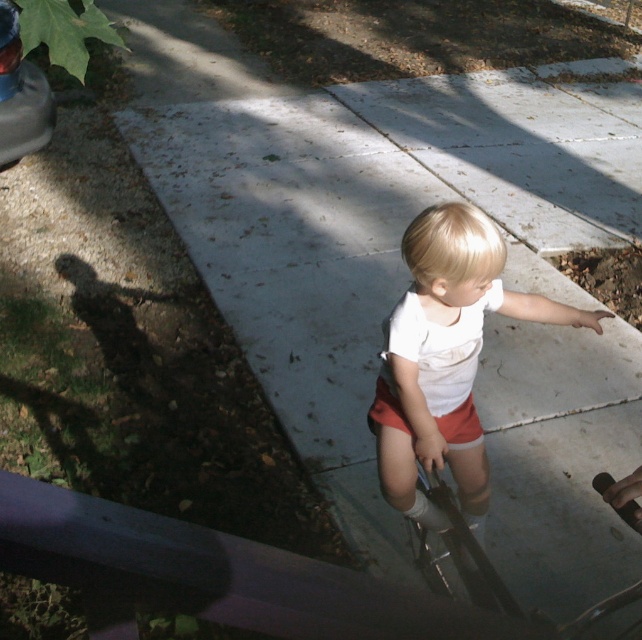
Question: Observing the image, what is the correct spatial positioning of shiny concrete puddle at lower right in reference to orange cotton shorts at center?

Choices:
 (A) left
 (B) right

Answer: (B)

Question: Does white matte shorts at center have a smaller size compared to orange cotton shorts at center?

Choices:
 (A) yes
 (B) no

Answer: (B)

Question: Does white matte shorts at center come behind shiny concrete puddle at lower right?

Choices:
 (A) yes
 (B) no

Answer: (B)

Question: Which of these objects is positioned closest to the white matte shorts at center?

Choices:
 (A) shiny concrete puddle at lower right
 (B) orange cotton shorts at center

Answer: (B)

Question: Which point appears farthest from the camera in this image?

Choices:
 (A) (435, 509)
 (B) (473, 442)

Answer: (B)

Question: Which point is farther from the camera taking this photo?

Choices:
 (A) (429, 372)
 (B) (476, 428)
 (C) (616, 288)

Answer: (C)